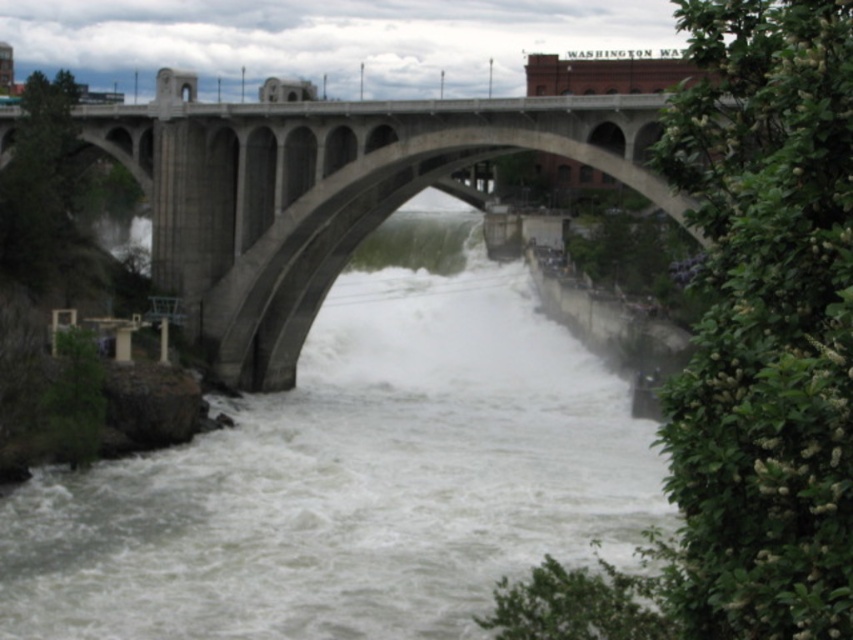
You are a photographer trying to capture the white frothy water at center and the concrete bridge at center in a single shot. Based on the scene, which object will appear closer to the camera in your photograph?

The white frothy water at center will appear closer to the camera because the concrete bridge at center is behind it.

You are a drone operator tasked with capturing aerial footage of the white frothy water at center and the concrete bridge at center. Your drone has a maximum flight range of 20 meters. Can you reach both locations from your current position without exceeding the drone range limit?

The white frothy water at center is 20.43 meters away from the concrete bridge at center. Since the drone can only fly up to 20 meters, it cannot reach both locations without exceeding its range limit.